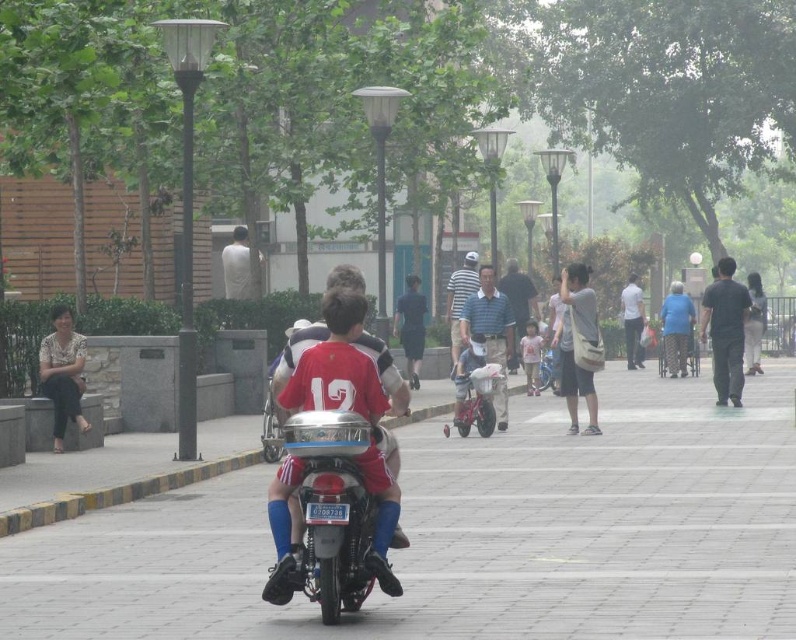
Who is more distant from viewer, (501, 401) or (634, 308)?

The point (634, 308) is behind.

Is point (500, 340) closer to viewer compared to point (638, 320)?

Yes, it is.

Which is in front, point (494, 314) or point (634, 304)?

Point (494, 314)

The width and height of the screenshot is (796, 640). Find the location of `striped polo shirt at center`. striped polo shirt at center is located at coordinates 490,332.

Where is `shiny metallic motorcycle at center`? shiny metallic motorcycle at center is located at coordinates (330, 512).

Can you confirm if shiny metallic motorcycle at center is smaller than matte gray bag at center?

No, shiny metallic motorcycle at center is not smaller than matte gray bag at center.

At what (x,y) coordinates should I click in order to perform the action: click on shiny metallic motorcycle at center. Please return your answer as a coordinate pair (x, y). This screenshot has height=640, width=796. Looking at the image, I should click on (330, 512).

Can you confirm if striped polo shirt at center is smaller than dark blue fabric shirt at center?

Actually, striped polo shirt at center might be larger than dark blue fabric shirt at center.

Does striped polo shirt at center have a lesser height compared to dark blue fabric shirt at center?

Incorrect, striped polo shirt at center's height does not fall short of dark blue fabric shirt at center's.

This screenshot has height=640, width=796. What do you see at coordinates (490, 332) in the screenshot? I see `striped polo shirt at center` at bounding box center [490, 332].

Find the location of a particular element. Image resolution: width=796 pixels, height=640 pixels. striped polo shirt at center is located at coordinates (490, 332).